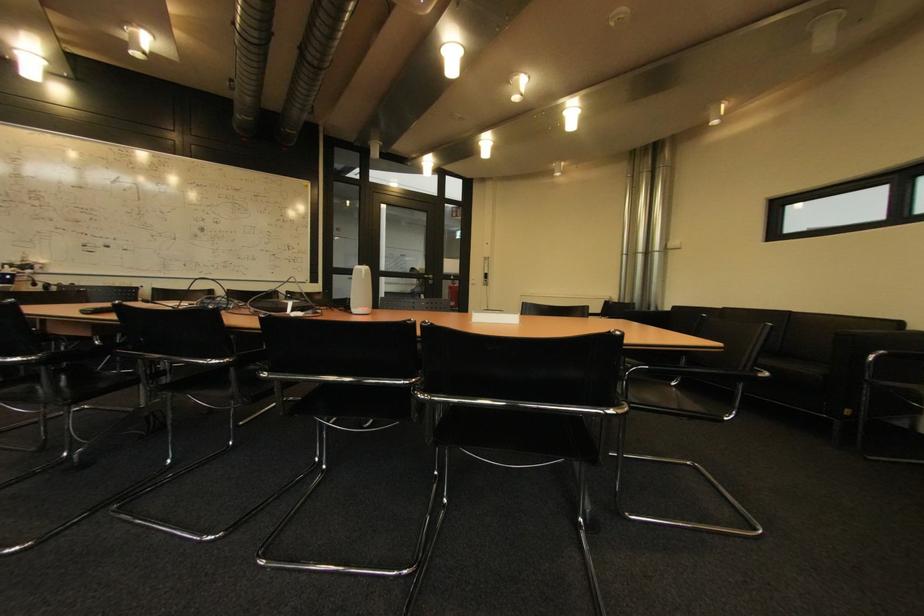
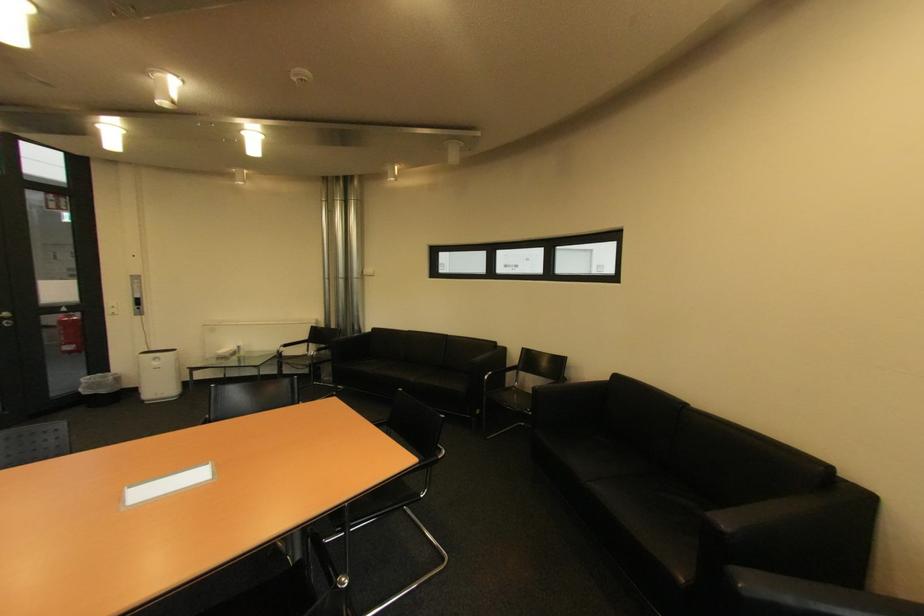
Where in the second image is the point corresponding to the point at 439,278 from the first image?

(14, 315)